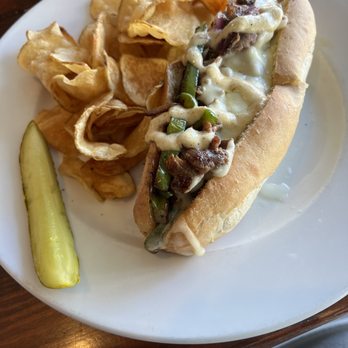
Locate an element on the screen. The image size is (348, 348). wooden table is located at coordinates (38, 335).